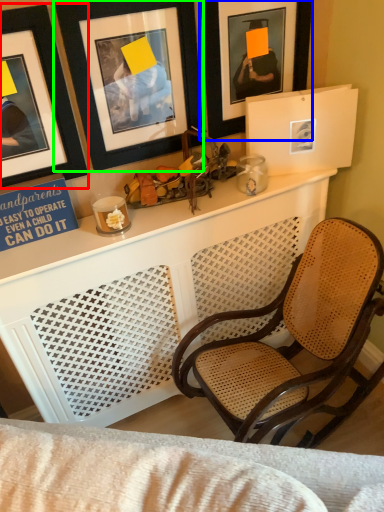
Question: Which object is positioned farthest from picture frame (highlighted by a red box)? Select from picture frame (highlighted by a blue box) and picture frame (highlighted by a green box).

Choices:
 (A) picture frame
 (B) picture frame

Answer: (A)